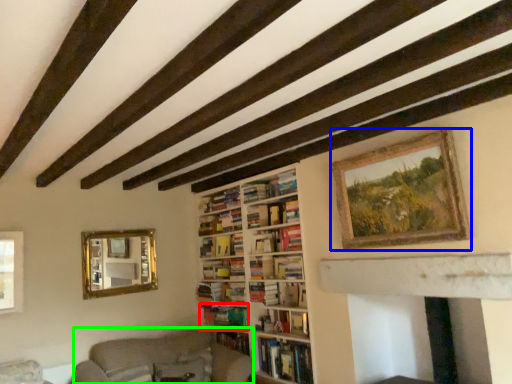
Question: Which object is the farthest from book (highlighted by a red box)? Choose among these: picture frame (highlighted by a blue box) or couch (highlighted by a green box).

Choices:
 (A) picture frame
 (B) couch

Answer: (A)